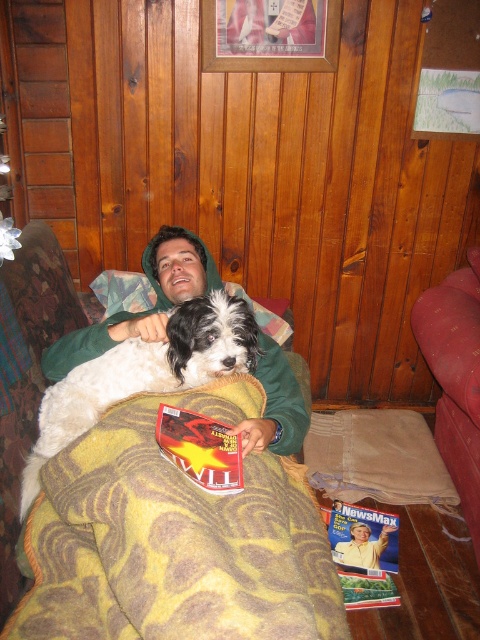
Consider the image. You are trying to decide whether to place a small pillow on the yellow fleece blanket at center. Considering the height of the white fluffy dog at upper center, will the pillow be visible from above the blanket?

The yellow fleece blanket at center has a lesser height compared to the white fluffy dog at upper center. Since the blanket is lower, the pillow placed on it would likely be visible from above, as the dog is taller and might not obstruct the view.

You are standing in the room and want to place a small toy for the white fluffy dog at upper center. According to the image, where should you place the toy relative to the dog?

The white fluffy dog at upper center is located at point 0.584 on the x axis and 0.300 on the y axis, so you should place the toy near those coordinates relative to the dog.

You are standing in the room and want to reach the point marked as point [300,472]. If your average walking speed is 3 feet per second, how long will it take you to reach that point?

The distance between you and point [300,472] is 4.79 feet. At a speed of 3 feet per second, it would take approximately 1.6 seconds to reach the point.